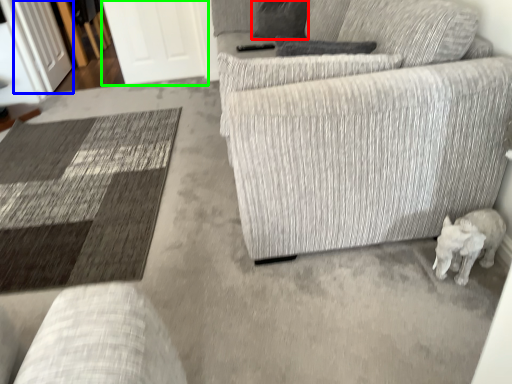
Question: Estimate the real-world distances between objects in this image. Which object is farther from pillow (highlighted by a red box), glass door (highlighted by a blue box) or glass door (highlighted by a green box)?

Choices:
 (A) glass door
 (B) glass door

Answer: (A)